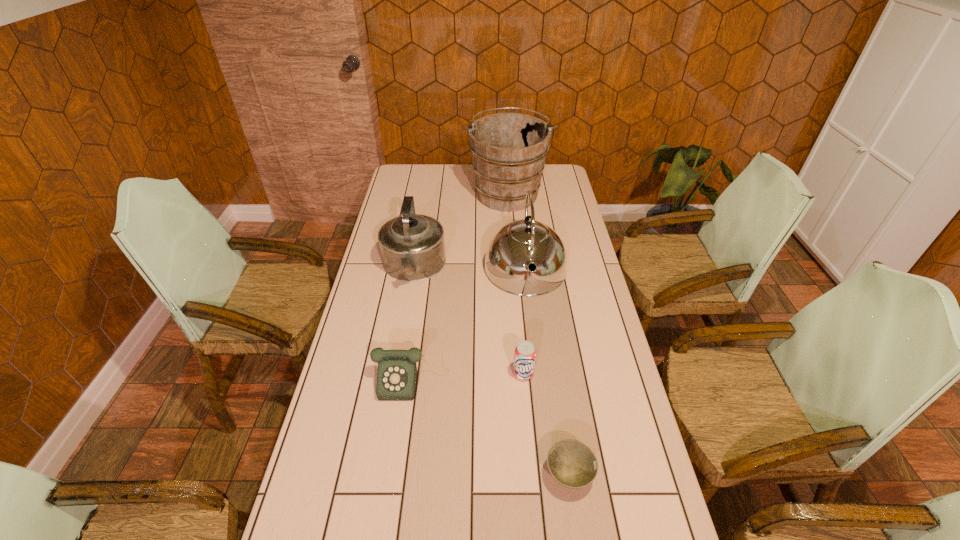
The height and width of the screenshot is (540, 960). What are the coordinates of `free spot that satisfies the following two spatial constraints: 1. with the spout at the front of the left kettle; 2. on the left side of the nearest object` in the screenshot? It's located at (378, 475).